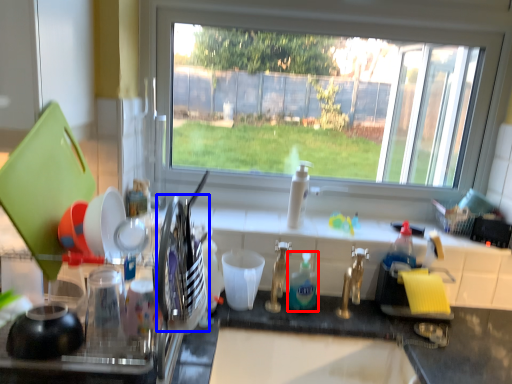
Question: Which object is closer to the camera taking this photo, cleaning product (highlighted by a red box) or tableware (highlighted by a blue box)?

Choices:
 (A) cleaning product
 (B) tableware

Answer: (B)